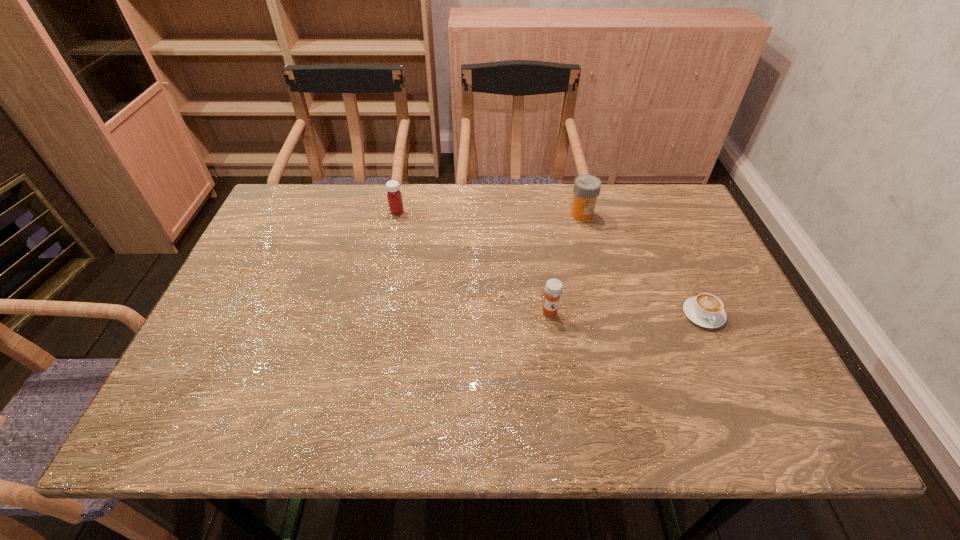
The image size is (960, 540). I want to click on free space between the third object from left to right and the third object from right to left, so click(x=565, y=263).

This screenshot has width=960, height=540. Identify the location of vacant area that lies between the cappuccino and the third object from left to right. (642, 264).

Where is `free spot between the rightmost medicine and the leftmost object`? free spot between the rightmost medicine and the leftmost object is located at coordinates point(490,213).

Where is `free space that is in between the cappuccino and the leftmost medicine`? The image size is (960, 540). free space that is in between the cappuccino and the leftmost medicine is located at coordinates (550, 263).

The height and width of the screenshot is (540, 960). What are the coordinates of `empty space that is in between the second object from right to left and the second object from left to right` in the screenshot? It's located at (565, 263).

Identify the location of empty space that is in between the cappuccino and the leftmost object. (550, 263).

I want to click on object that is the second closest one to the second object from right to left, so click(x=706, y=310).

At what (x,y) coordinates should I click in order to perform the action: click on object identified as the second closest to the rightmost medicine. Please return your answer as a coordinate pair (x, y). This screenshot has height=540, width=960. Looking at the image, I should click on (706, 310).

Choose which medicine is the second nearest neighbor to the shortest object. Please provide its 2D coordinates. Your answer should be formatted as a tuple, i.e. [(x, y)], where the tuple contains the x and y coordinates of a point satisfying the conditions above.

[(587, 187)]

Identify the location of medicine that is the second closest to the second medicine from left to right. Image resolution: width=960 pixels, height=540 pixels. (394, 196).